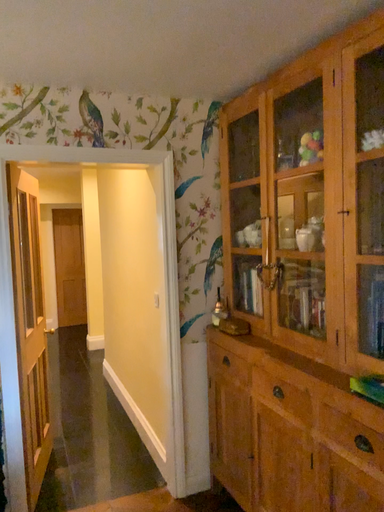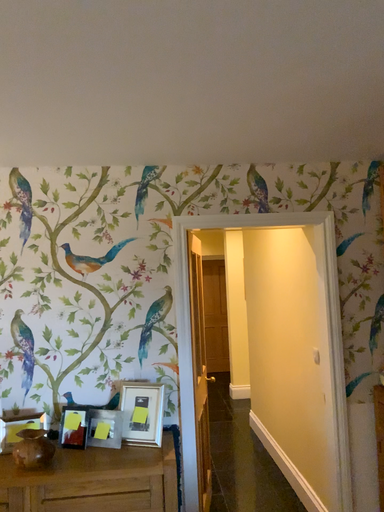
Question: How did the camera likely rotate when shooting the video?

Choices:
 (A) rotated left
 (B) rotated right

Answer: (A)